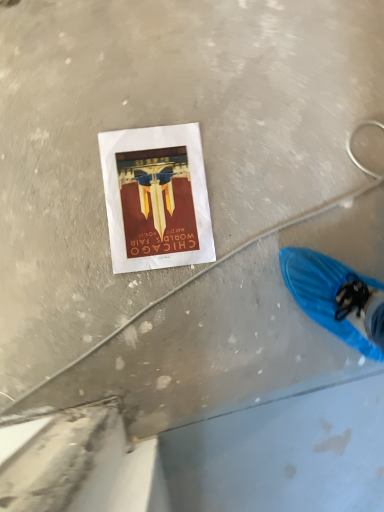
The height and width of the screenshot is (512, 384). What are the coordinates of `vacant space behind matte paper poster at center` in the screenshot? It's located at (186, 94).